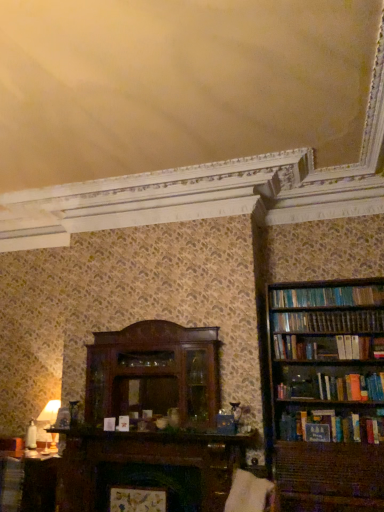
Question: Is matte white table lamp at left in front of or behind white fabric swivel chair at lower center in the image?

Choices:
 (A) front
 (B) behind

Answer: (B)

Question: Looking at the image, does matte white table lamp at left seem bigger or smaller compared to white fabric swivel chair at lower center?

Choices:
 (A) small
 (B) big

Answer: (A)

Question: Which object is positioned farthest from the wooden bookshelf at right?

Choices:
 (A) white fabric swivel chair at lower center
 (B) matte white table lamp at left
 (C) matte brown table at lower left
 (D) matte brown book at lower left

Answer: (D)

Question: Which of these objects is positioned closest to the matte brown book at lower left?

Choices:
 (A) white fabric swivel chair at lower center
 (B) wooden bookshelf at right
 (C) matte brown table at lower left
 (D) matte white table lamp at left

Answer: (C)